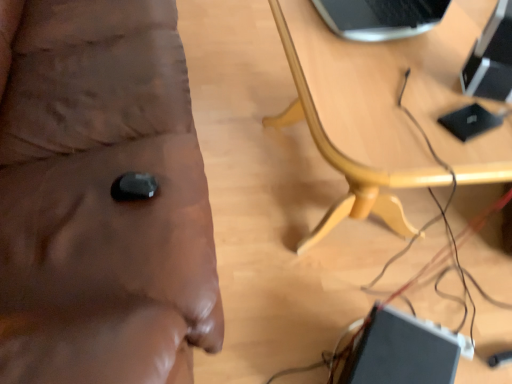
I want to click on empty space that is ontop of wooden table at center, so click(405, 66).